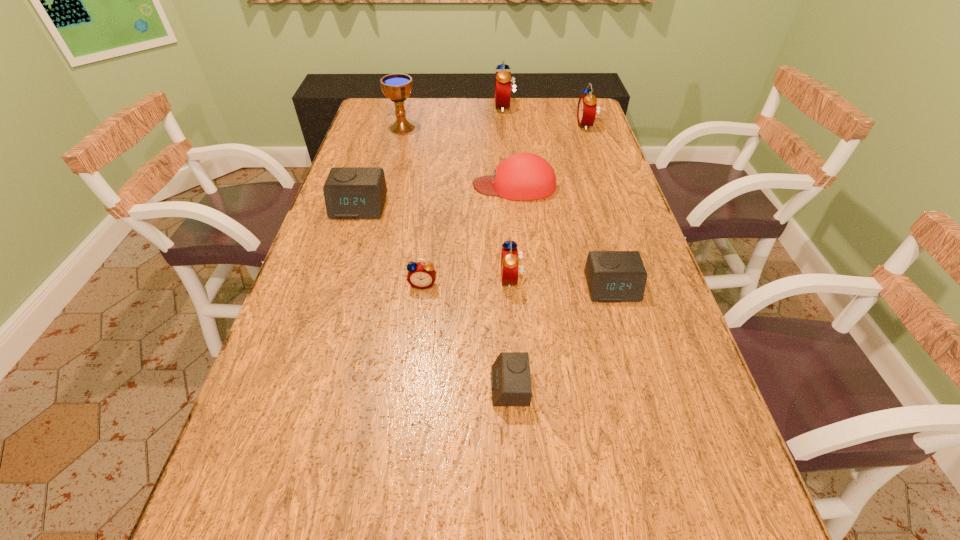
Image resolution: width=960 pixels, height=540 pixels. Identify the location of vacant space located 0.220m on the front-facing side of the second tallest alarm clock. (517, 125).

At what (x,y) coordinates should I click in order to perform the action: click on free spot located on the front-facing side of the second tallest alarm clock. Please return your answer as a coordinate pair (x, y). Looking at the image, I should click on (498, 125).

Identify the location of free space located on the front-facing side of the third tallest alarm clock. (472, 279).

At what (x,y) coordinates should I click in order to perform the action: click on vacant space located 0.230m on the front-facing side of the third tallest alarm clock. Please return your answer as a coordinate pair (x, y). The image size is (960, 540). Looking at the image, I should click on (406, 279).

The image size is (960, 540). What are the coordinates of `free region located 0.070m on the front-facing side of the third tallest alarm clock` in the screenshot? It's located at (472, 279).

Locate an element on the screen. vacant point located on the front-facing side of the baseball cap is located at coordinates (420, 186).

Locate an element on the screen. The width and height of the screenshot is (960, 540). free spot located on the front-facing side of the baseball cap is located at coordinates (341, 186).

You are a GUI agent. You are given a task and a screenshot of the screen. Output one action in this format:
    pyautogui.click(x=<x>, y=<y>)
    Task: Click on the free space located on the front-facing side of the baseball cap
    This screenshot has width=960, height=540.
    Given the screenshot: What is the action you would take?
    pyautogui.click(x=394, y=186)

This screenshot has width=960, height=540. I want to click on vacant region located 0.330m on the front-facing side of the farthest black alarm clock, so click(x=326, y=312).

Where is `vacant space located 0.360m on the front-facing side of the smallest red alarm clock`? The width and height of the screenshot is (960, 540). vacant space located 0.360m on the front-facing side of the smallest red alarm clock is located at coordinates (404, 438).